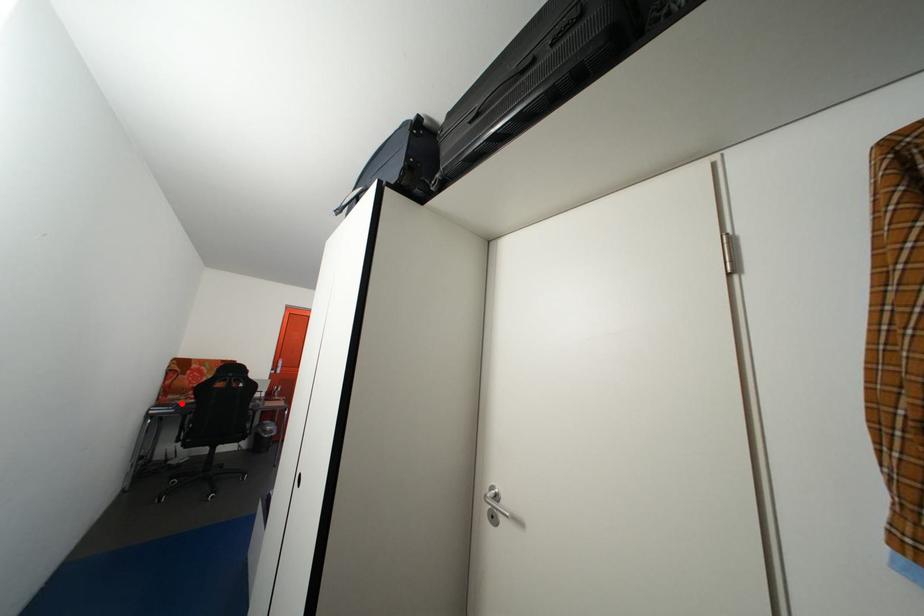
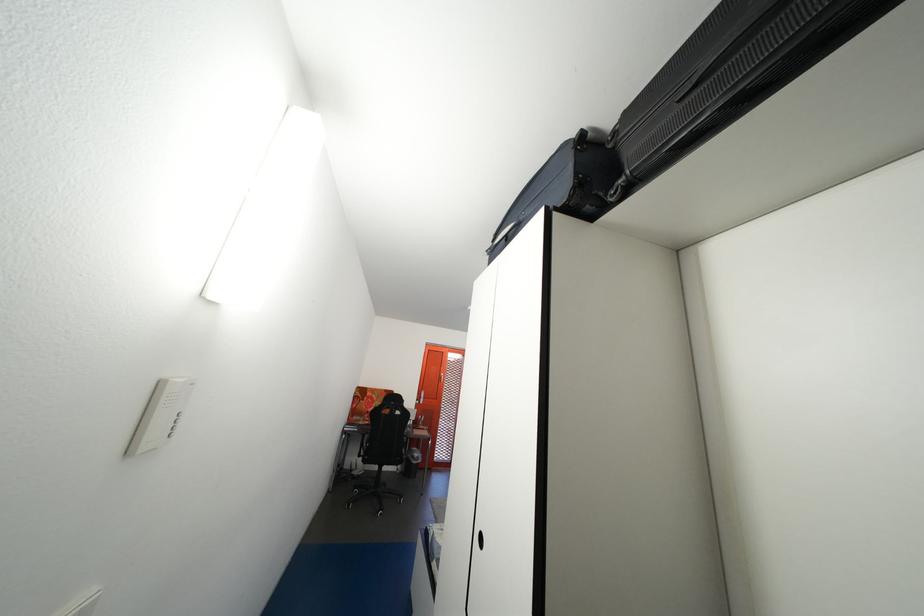
Question: A red point is marked in image1. In image2, is the corresponding 3D point closer to the camera or farther? Reply with the corresponding letter.

Choices:
 (A) The corresponding 3D point is closer.
 (B) The corresponding 3D point is farther.

Answer: (B)